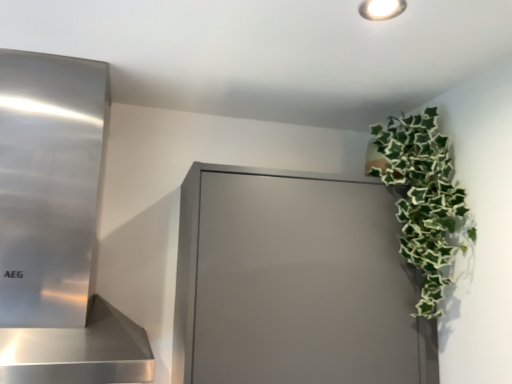
Question: Should I look upward or downward to see matte gray cabinet at upper right?

Choices:
 (A) up
 (B) down

Answer: (B)

Question: Is matte gray cabinet at upper right beside green leafy plant at upper right?

Choices:
 (A) yes
 (B) no

Answer: (B)

Question: Considering the relative positions of matte gray cabinet at upper right and green leafy plant at upper right in the image provided, is matte gray cabinet at upper right behind green leafy plant at upper right?

Choices:
 (A) yes
 (B) no

Answer: (B)

Question: From a real-world perspective, is matte gray cabinet at upper right over green leafy plant at upper right?

Choices:
 (A) no
 (B) yes

Answer: (A)

Question: Considering the relative positions of matte gray cabinet at upper right and green leafy plant at upper right in the image provided, is matte gray cabinet at upper right to the right of green leafy plant at upper right from the viewer's perspective?

Choices:
 (A) yes
 (B) no

Answer: (B)

Question: Is matte gray cabinet at upper right turned away from green leafy plant at upper right?

Choices:
 (A) no
 (B) yes

Answer: (A)

Question: Is matte gray cabinet at upper right far from green leafy plant at upper right?

Choices:
 (A) yes
 (B) no

Answer: (B)

Question: Is there a large distance between green leafy plant at upper right and polished stainless steel range hood at left?

Choices:
 (A) yes
 (B) no

Answer: (B)

Question: From the image's perspective, is green leafy plant at upper right over polished stainless steel range hood at left?

Choices:
 (A) no
 (B) yes

Answer: (A)

Question: Is green leafy plant at upper right at the left side of polished stainless steel range hood at left?

Choices:
 (A) no
 (B) yes

Answer: (A)

Question: Is green leafy plant at upper right closer to the viewer compared to polished stainless steel range hood at left?

Choices:
 (A) yes
 (B) no

Answer: (B)

Question: Is green leafy plant at upper right wider than polished stainless steel range hood at left?

Choices:
 (A) no
 (B) yes

Answer: (A)

Question: Would you say green leafy plant at upper right is outside polished stainless steel range hood at left?

Choices:
 (A) yes
 (B) no

Answer: (A)

Question: From a real-world perspective, is polished stainless steel range hood at left located higher than green leafy plant at upper right?

Choices:
 (A) yes
 (B) no

Answer: (B)